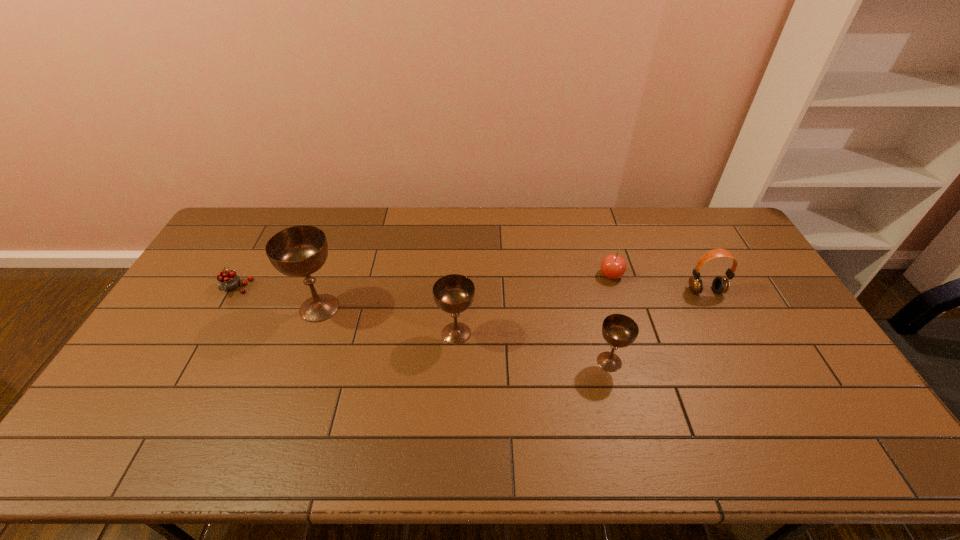
Given the evenly spaced chalices in the image, where should an extra chalice be added on the right to preserve the spacing? Please point to a vacant space. Please provide its 2D coordinates. Your answer should be formatted as a tuple, i.e. [(x, y)], where the tuple contains the x and y coordinates of a point satisfying the conditions above.

[(781, 394)]